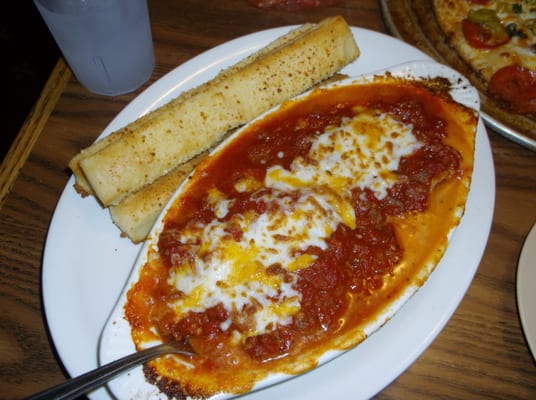
Locate an element on the screen. This screenshot has width=536, height=400. beverage glass is located at coordinates (104, 40).